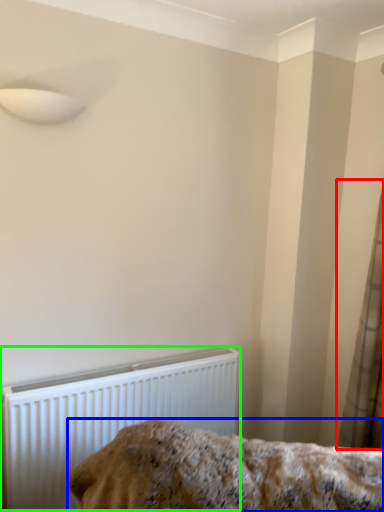
Question: Estimate the real-world distances between objects in this image. Which object is closer to curtain (highlighted by a red box), furniture (highlighted by a blue box) or radiator (highlighted by a green box)?

Choices:
 (A) furniture
 (B) radiator

Answer: (A)